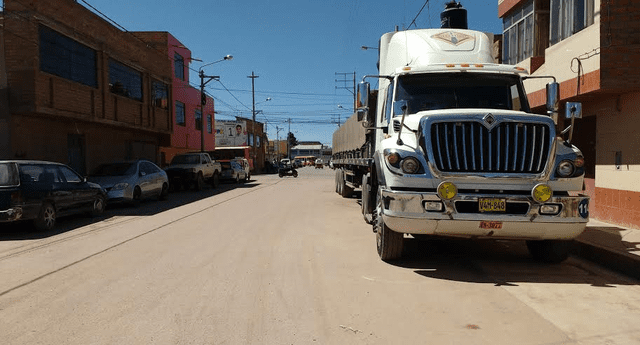
Locate an element on the screen. This screenshot has width=640, height=345. mirrors is located at coordinates (572, 116), (392, 113), (353, 102), (560, 97).